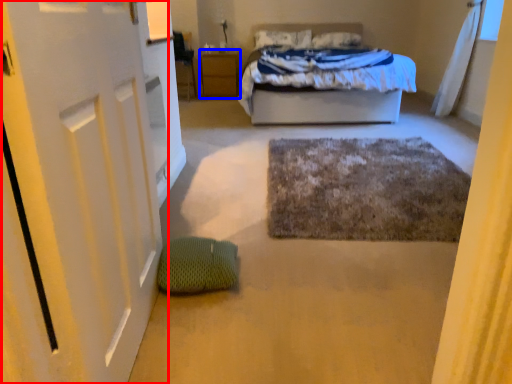
Question: Which object appears farthest to the camera in this image, door (highlighted by a red box) or nightstand (highlighted by a blue box)?

Choices:
 (A) door
 (B) nightstand

Answer: (B)